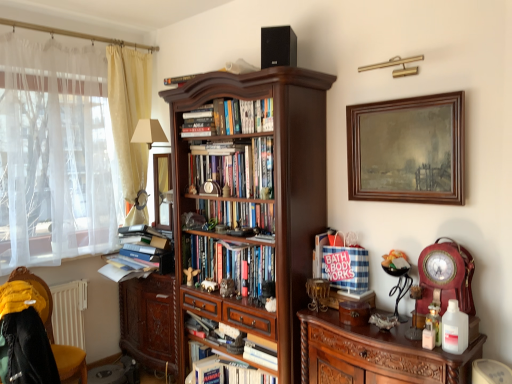
Question: Can you confirm if hardcover books at center, acting as the 3th book starting from the bottom, is thinner than hardcover books at center, which appears as the second book when ordered from the bottom?

Choices:
 (A) no
 (B) yes

Answer: (B)

Question: Considering the relative positions of hardcover books at center, which is counted as the third book, starting from the top, and hardcover books at center, acting as the 4th book starting from the top, in the image provided, is hardcover books at center, which is counted as the third book, starting from the top, in front of hardcover books at center, acting as the 4th book starting from the top,?

Choices:
 (A) yes
 (B) no

Answer: (B)

Question: Is hardcover books at center, acting as the 4th book starting from the top, at the back of hardcover books at center, which is counted as the third book, starting from the top?

Choices:
 (A) yes
 (B) no

Answer: (B)

Question: Is hardcover books at center, acting as the 3th book starting from the bottom, positioned beyond the bounds of hardcover books at center, acting as the 4th book starting from the top?

Choices:
 (A) no
 (B) yes

Answer: (B)

Question: From the image's perspective, is hardcover books at center, acting as the 3th book starting from the bottom, under hardcover books at center, acting as the 4th book starting from the top?

Choices:
 (A) no
 (B) yes

Answer: (A)

Question: Does hardcover books at center, acting as the 3th book starting from the bottom, appear on the right side of hardcover books at center, which appears as the second book when ordered from the bottom?

Choices:
 (A) no
 (B) yes

Answer: (A)

Question: Is yellow fabric curtain at left, marked as the second curtain in a left-to-right arrangement, placed right next to hardcover books at center, which is counted as the first book, starting from the top?

Choices:
 (A) no
 (B) yes

Answer: (A)

Question: Is yellow fabric curtain at left, the first curtain viewed from the right, bigger than hardcover books at center, which is counted as the first book, starting from the top?

Choices:
 (A) yes
 (B) no

Answer: (A)

Question: Considering the relative sizes of yellow fabric curtain at left, the first curtain viewed from the right, and hardcover books at center, which is counted as the first book, starting from the top, in the image provided, is yellow fabric curtain at left, the first curtain viewed from the right, wider than hardcover books at center, which is counted as the first book, starting from the top,?

Choices:
 (A) yes
 (B) no

Answer: (A)

Question: From the image's perspective, would you say yellow fabric curtain at left, the first curtain viewed from the right, is positioned over hardcover books at center, which is counted as the first book, starting from the top?

Choices:
 (A) yes
 (B) no

Answer: (B)

Question: Is yellow fabric curtain at left, marked as the second curtain in a left-to-right arrangement, smaller than hardcover books at center, which is counted as the first book, starting from the top?

Choices:
 (A) no
 (B) yes

Answer: (A)

Question: From a real-world perspective, is yellow fabric curtain at left, marked as the second curtain in a left-to-right arrangement, physically above hardcover books at center, which is counted as the first book, starting from the top?

Choices:
 (A) yes
 (B) no

Answer: (B)

Question: Is hardcover books at center, the 5th book from the top, at the left side of yellow fabric curtain at left, the first curtain viewed from the right?

Choices:
 (A) no
 (B) yes

Answer: (A)